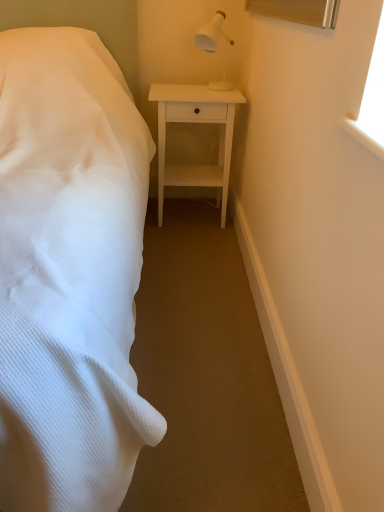
Question: Is white plastic lamp at upper right oriented towards white matte nightstand at center?

Choices:
 (A) yes
 (B) no

Answer: (B)

Question: Considering the relative sizes of white plastic lamp at upper right and white matte nightstand at center in the image provided, is white plastic lamp at upper right thinner than white matte nightstand at center?

Choices:
 (A) yes
 (B) no

Answer: (A)

Question: Can you confirm if white plastic lamp at upper right is positioned to the left of white matte nightstand at center?

Choices:
 (A) yes
 (B) no

Answer: (B)

Question: Is white matte nightstand at center located within white plastic lamp at upper right?

Choices:
 (A) yes
 (B) no

Answer: (B)

Question: From a real-world perspective, is white plastic lamp at upper right beneath white matte nightstand at center?

Choices:
 (A) no
 (B) yes

Answer: (A)

Question: From their relative heights in the image, would you say white matte nightstand at center is taller or shorter than white plastic lamp at upper right?

Choices:
 (A) tall
 (B) short

Answer: (A)

Question: In terms of width, does white matte nightstand at center look wider or thinner when compared to white plastic lamp at upper right?

Choices:
 (A) thin
 (B) wide

Answer: (B)

Question: Do you think white matte nightstand at center is within white plastic lamp at upper right, or outside of it?

Choices:
 (A) inside
 (B) outside

Answer: (B)

Question: In the image, is white matte nightstand at center positioned in front of or behind white plastic lamp at upper right?

Choices:
 (A) front
 (B) behind

Answer: (B)

Question: Is white matte nightstand at center inside the boundaries of white textured bed at left, or outside?

Choices:
 (A) inside
 (B) outside

Answer: (A)

Question: In terms of width, does white matte nightstand at center look wider or thinner when compared to white textured bed at left?

Choices:
 (A) wide
 (B) thin

Answer: (B)

Question: Would you say white matte nightstand at center is to the left or to the right of white textured bed at left in the picture?

Choices:
 (A) right
 (B) left

Answer: (A)

Question: Considering their positions, is white matte nightstand at center located in front of or behind white textured bed at left?

Choices:
 (A) behind
 (B) front

Answer: (A)

Question: Based on their sizes in the image, would you say white textured bed at left is bigger or smaller than white matte nightstand at center?

Choices:
 (A) small
 (B) big

Answer: (B)

Question: From their relative heights in the image, would you say white textured bed at left is taller or shorter than white matte nightstand at center?

Choices:
 (A) short
 (B) tall

Answer: (B)